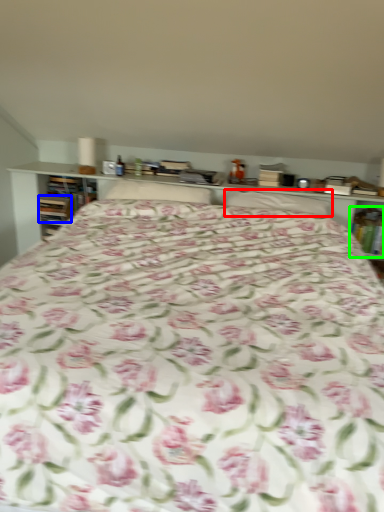
Question: Which object is the closest to the pillow (highlighted by a red box)? Choose among these: book (highlighted by a blue box) or book (highlighted by a green box).

Choices:
 (A) book
 (B) book

Answer: (B)